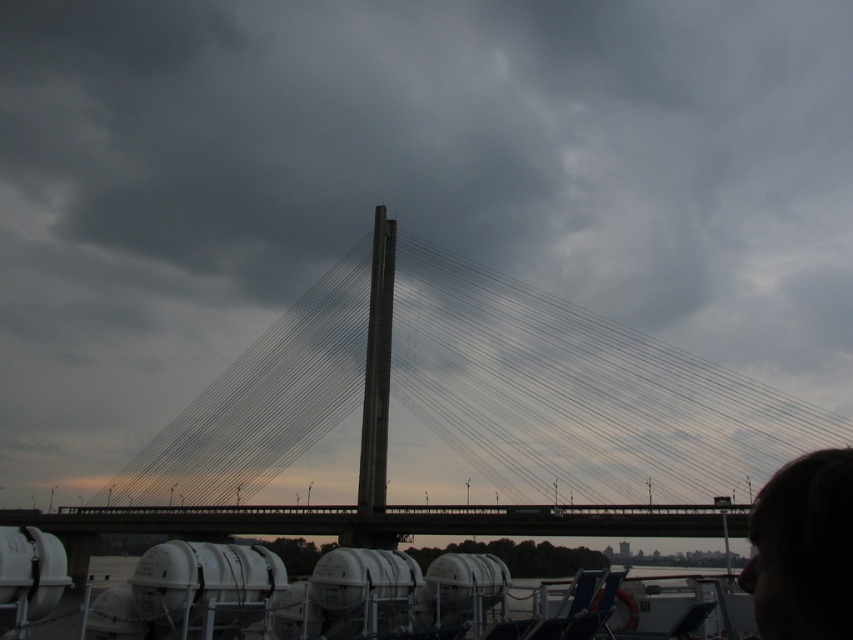
Is the position of concrete bridge at center more distant than that of dark hair at upper right?

Yes, it is.

Locate an element on the screen. concrete bridge at center is located at coordinates (474, 396).